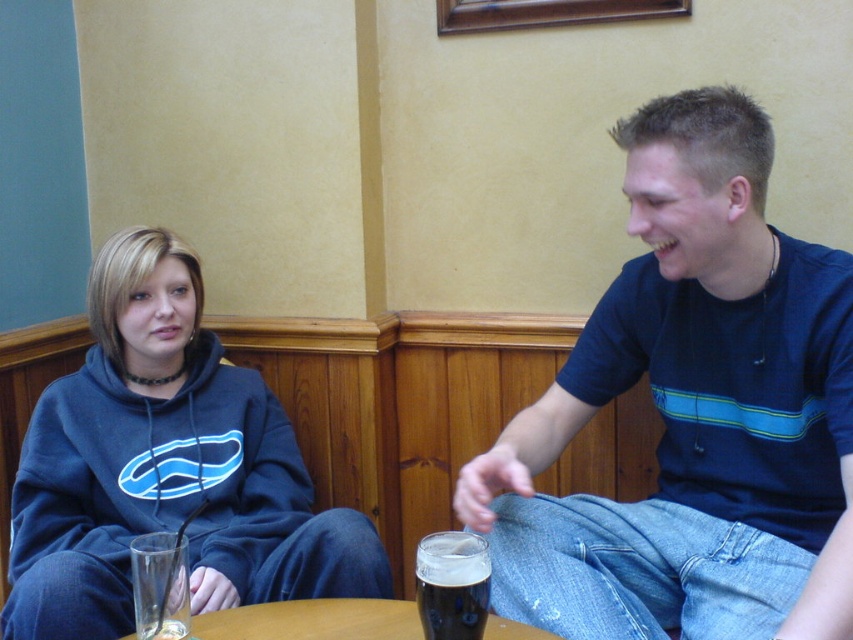
You are taking a photo of two people sitting at a table. The first person is at point (x=126, y=288) and the second is at point (x=213, y=634). Which person is closer to the camera?

The person at point (x=126, y=288) is closer to the camera than the person at point (x=213, y=634).